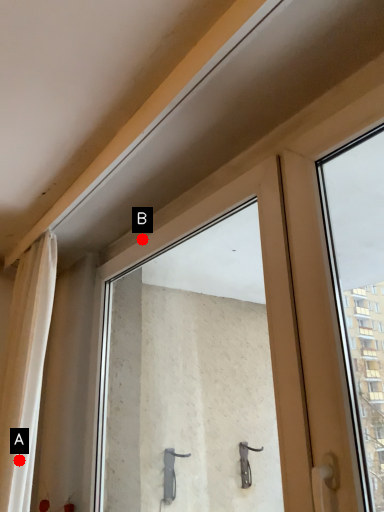
Question: Two points are circled on the image, labeled by A and B beside each circle. Which point is closer to the camera?

Choices:
 (A) A is closer
 (B) B is closer

Answer: (A)